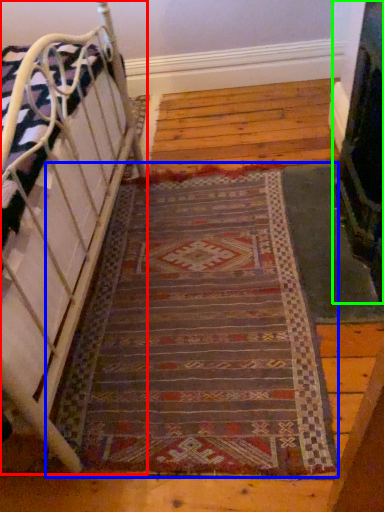
Question: Estimate the real-world distances between objects in this image. Which object is closer to furniture (highlighted by a red box), mat (highlighted by a blue box) or fireplace (highlighted by a green box)?

Choices:
 (A) mat
 (B) fireplace

Answer: (A)